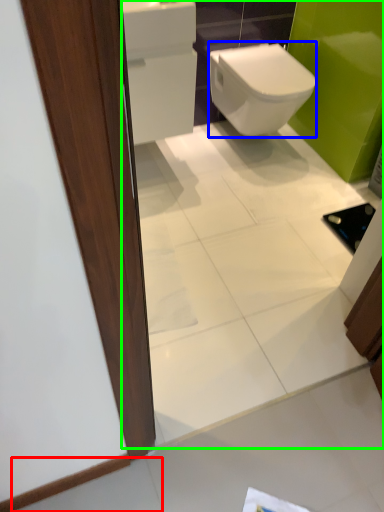
Question: Which object is the closest to the tile (highlighted by a red box)? Choose among these: bidet (highlighted by a blue box) or mirror (highlighted by a green box).

Choices:
 (A) bidet
 (B) mirror

Answer: (B)